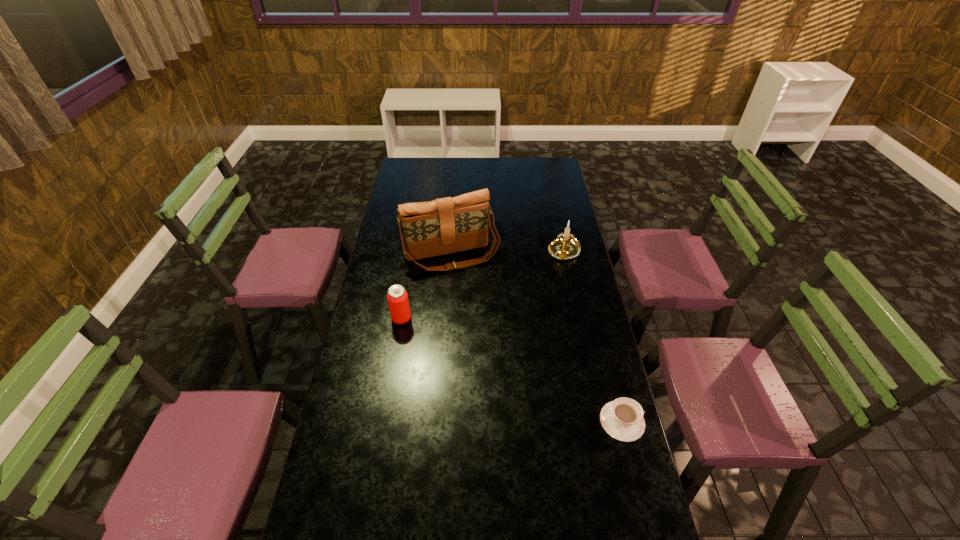
Locate an element on the screen. The width and height of the screenshot is (960, 540). vacant spot on the desktop that is between the third farthest object and the teacup and is positioned on the front-facing side of the tallest object is located at coordinates (492, 361).

At what (x,y) coordinates should I click in order to perform the action: click on vacant space on the desktop that is between the beer can and the teacup and is positioned on the handle side of the candle holder. Please return your answer as a coordinate pair (x, y). Looking at the image, I should click on (479, 355).